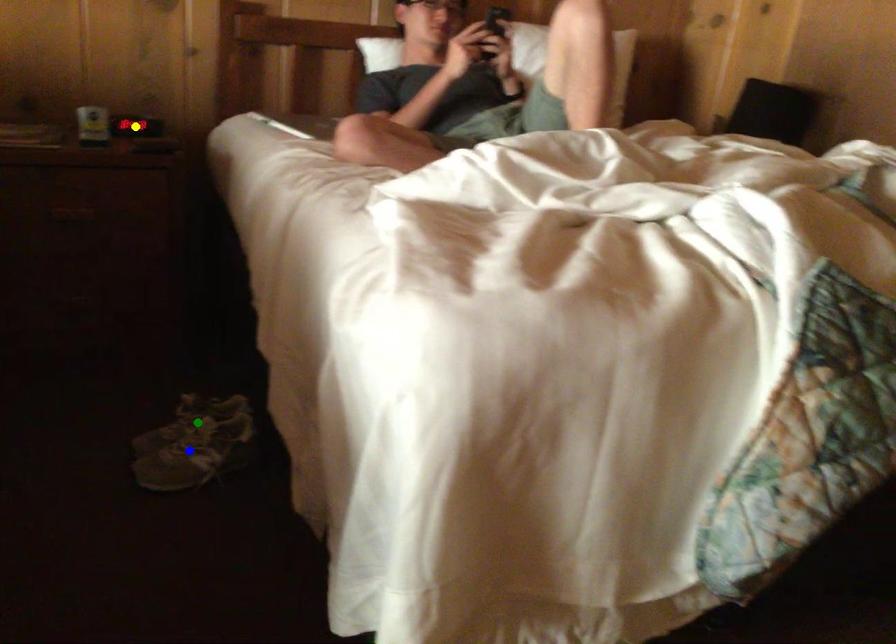
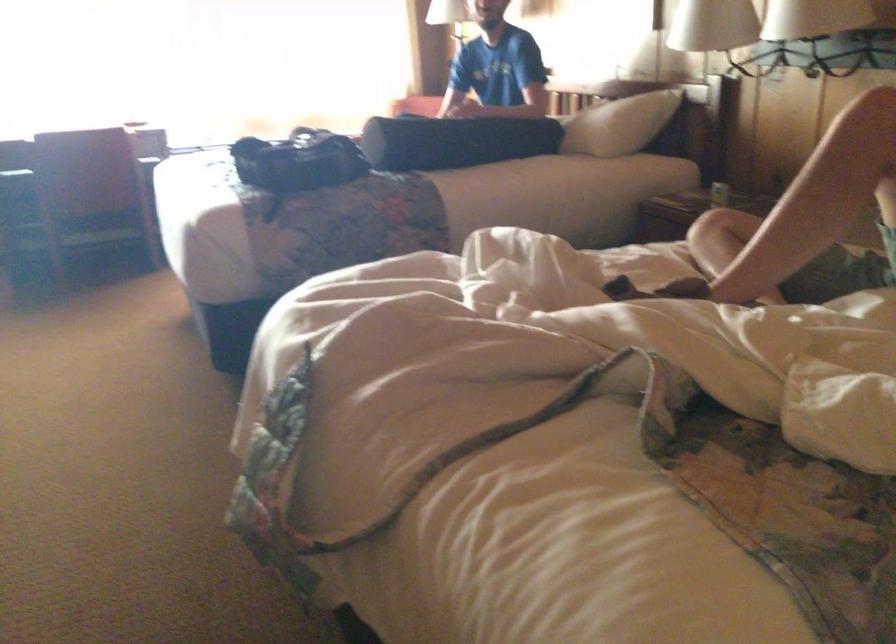
I am providing you with two images of the same scene from different viewpoints. Three points are marked in image1. Which point corresponds to a part or object that is occluded in image2?In image1, three points are marked. Which of them correspond to a part or object that is occluded in image2?Among the three points shown in image1, which one corresponds to a part or object that is no longer visible due to occlusion in image2?

green point, blue point, yellow point cannot be seen in image2.